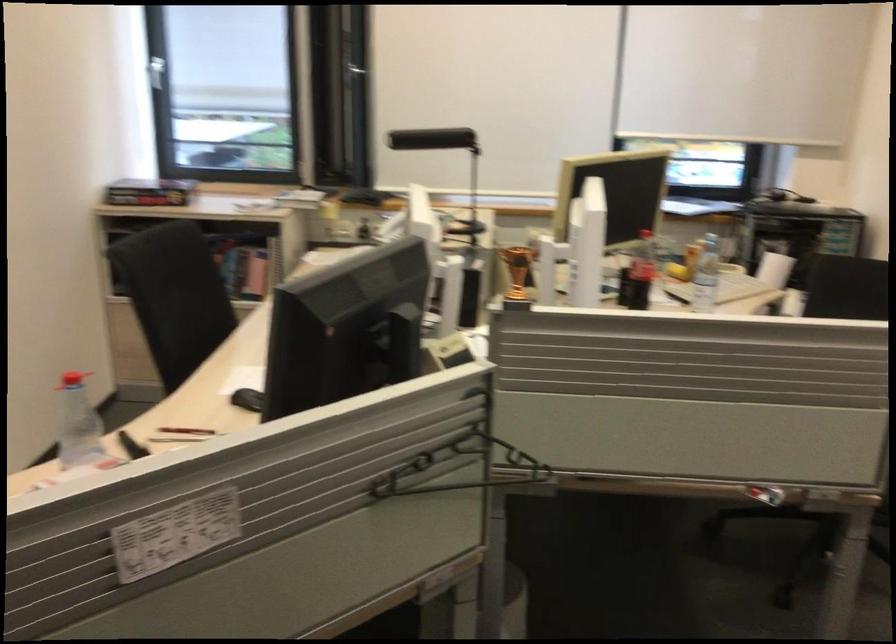
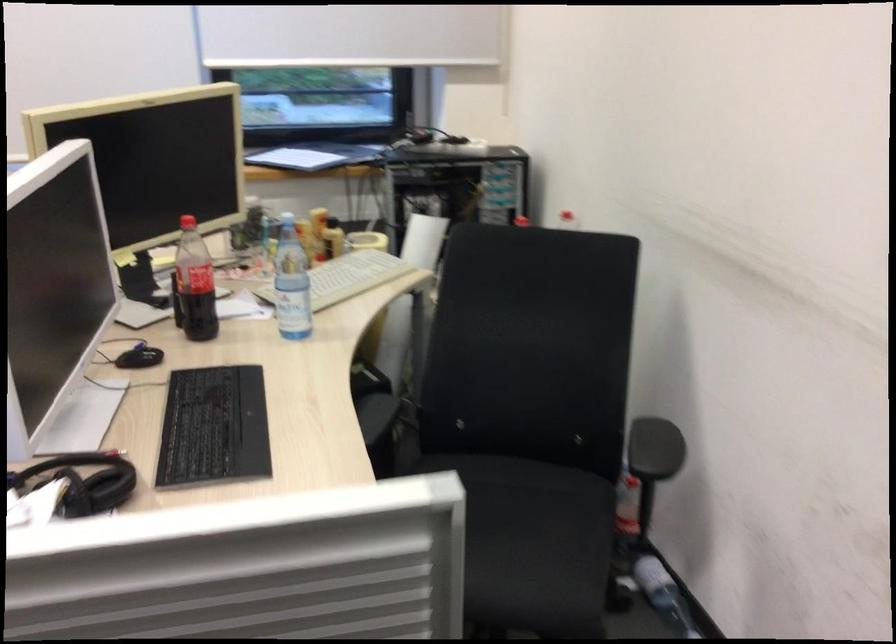
The images are taken continuously from a first-person perspective. In which direction are you moving?

The movement direction of the cameraman is right, forward.